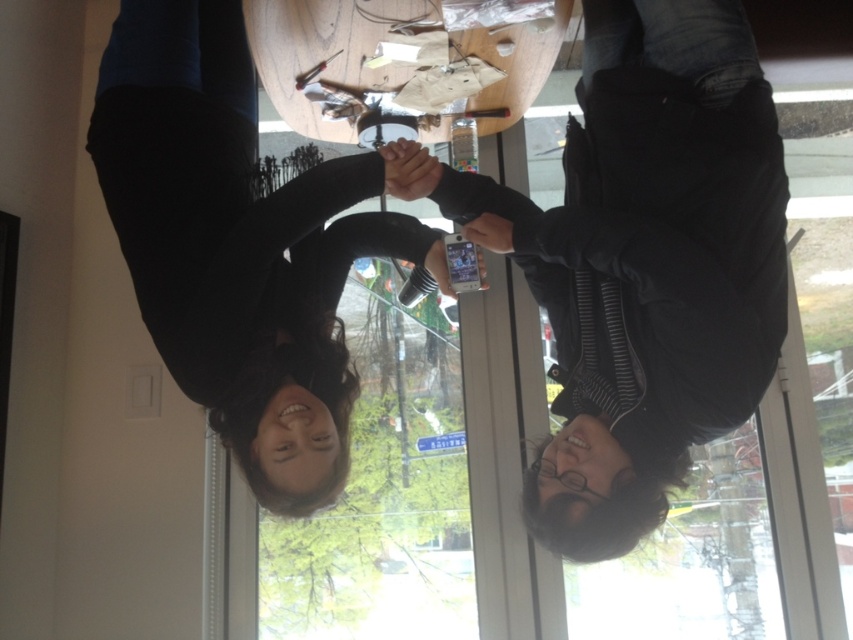
Question: Among these objects, which one is farthest from the camera?

Choices:
 (A) matte black phone at center
 (B) black matte hair at upper center

Answer: (B)

Question: Among these points, which one is nearest to the camera?

Choices:
 (A) (729, 326)
 (B) (300, 376)

Answer: (A)

Question: Does matte black phone at center have a larger size compared to black matte hair at upper center?

Choices:
 (A) yes
 (B) no

Answer: (B)

Question: Is matte black phone at center closer to camera compared to black matte hair at upper center?

Choices:
 (A) yes
 (B) no

Answer: (A)

Question: Is the position of matte black phone at center more distant than that of black matte hair at upper center?

Choices:
 (A) yes
 (B) no

Answer: (B)